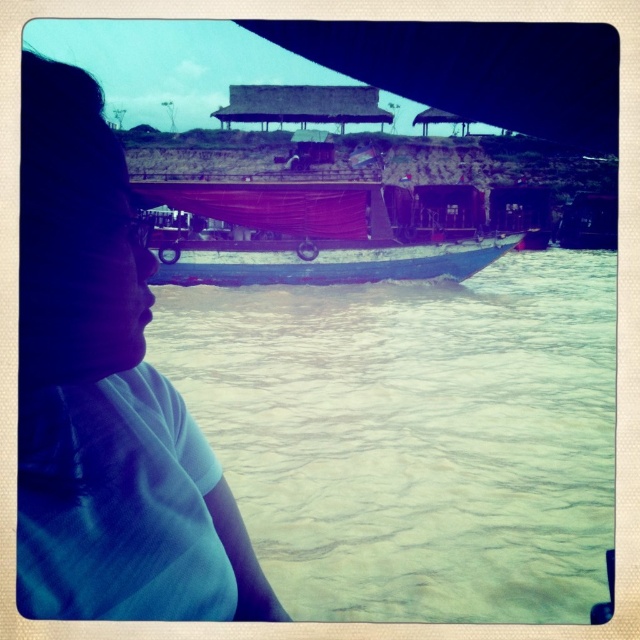
You are an observer on a boat and see the white matte shirt at left and the wooden boat at center. Which object is larger in size?

The wooden boat at center is larger than the white matte shirt at left.

You are navigating a boat on the river and need to avoid a specific area. Based on the image, where is the greenish murky water at center located in terms of coordinates?

The greenish murky water at center is located at coordinates point (413, 435).

You are on a boat ride and notice the greenish murky water at center and the white matte shirt at left. From your perspective, which object is positioned to the right?

The greenish murky water at center is positioned to the right of the white matte shirt at left.